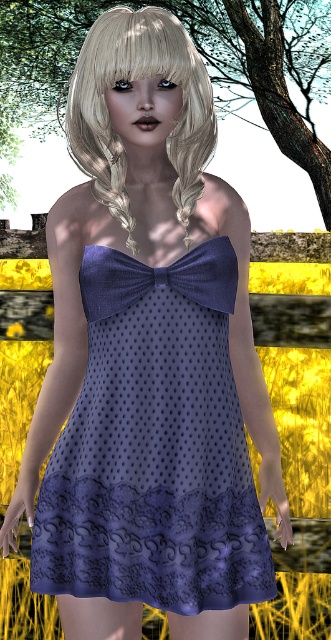
Question: Which point is farther to the camera?

Choices:
 (A) (94, 81)
 (B) (271, 45)
 (C) (103, 588)

Answer: (B)

Question: Does matte purple dress at center appear over blondehair at center?

Choices:
 (A) yes
 (B) no

Answer: (B)

Question: In this image, where is matte purple dress at center located relative to blondehair at center?

Choices:
 (A) right
 (B) left

Answer: (A)

Question: Which point is closer to the camera?

Choices:
 (A) (x=99, y=348)
 (B) (x=197, y=20)

Answer: (A)

Question: Which of the following is the closest to the observer?

Choices:
 (A) green leafy tree at upper center
 (B) matte purple dress at center

Answer: (B)

Question: Can you confirm if matte purple dress at center is positioned above blondehair at center?

Choices:
 (A) yes
 (B) no

Answer: (B)